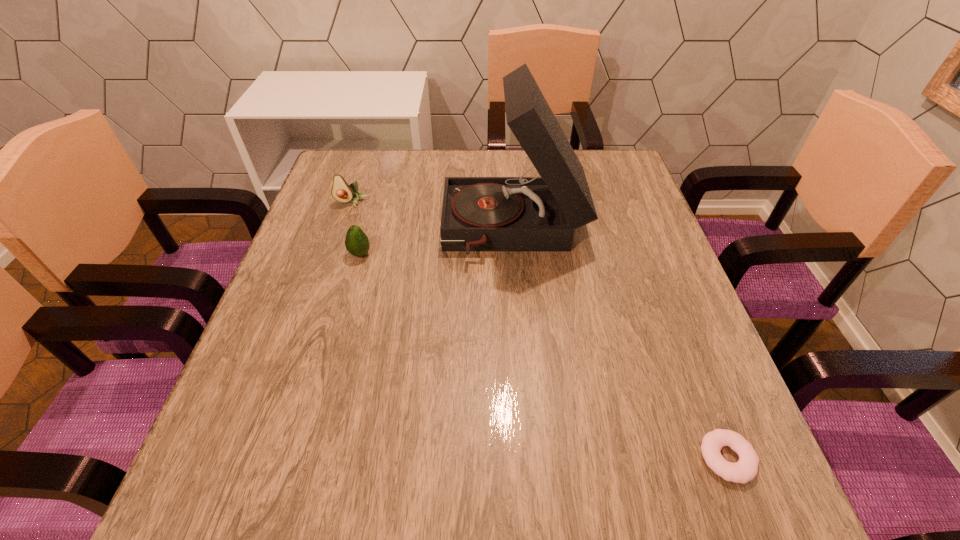
I want to click on the tallest object, so click(521, 213).

Locate an element on the screen. phonograph_record is located at coordinates (x=521, y=213).

Find the location of a particular element. Image resolution: width=960 pixels, height=540 pixels. the farther avocado is located at coordinates (341, 191).

I want to click on the shorter avocado, so click(x=357, y=243).

The height and width of the screenshot is (540, 960). Identify the location of the nearer avocado. (357, 243).

Where is `the nearest object`? The height and width of the screenshot is (540, 960). the nearest object is located at coordinates (746, 469).

The image size is (960, 540). In order to click on the shortest object in this screenshot , I will do `click(746, 469)`.

Locate an element on the screen. Image resolution: width=960 pixels, height=540 pixels. vacant area located on the front-facing side of the second object from right to left is located at coordinates (398, 231).

The height and width of the screenshot is (540, 960). Find the location of `vacant space located 0.200m on the front-facing side of the second object from right to left`. vacant space located 0.200m on the front-facing side of the second object from right to left is located at coordinates (362, 231).

The image size is (960, 540). Identify the location of blank space located 0.130m on the front-facing side of the second object from right to left. (391, 231).